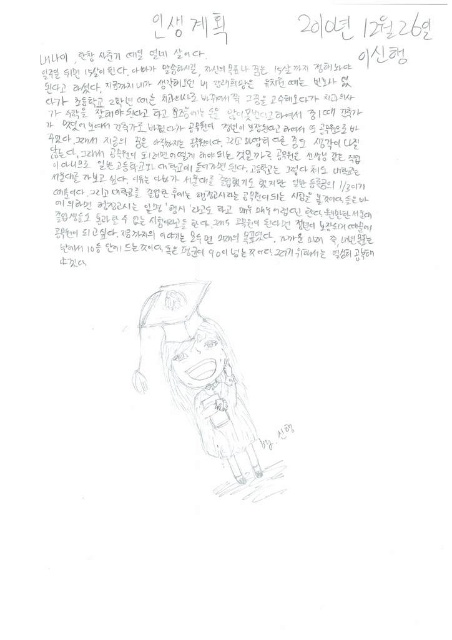
What is the exact 2D coordinate of the black paper at center in the image?

The black paper at center is located at the coordinate point of (216, 147).

You are organizing a school exhibition and need to place two items from the image on a display board. The items are the black paper at center and the sketchy pencil drawing of a person at center. According to the image, which item should be placed on the left side of the display board?

The sketchy pencil drawing of a person at center should be placed on the left side of the display board because the black paper at center is to the right of it in the original image.